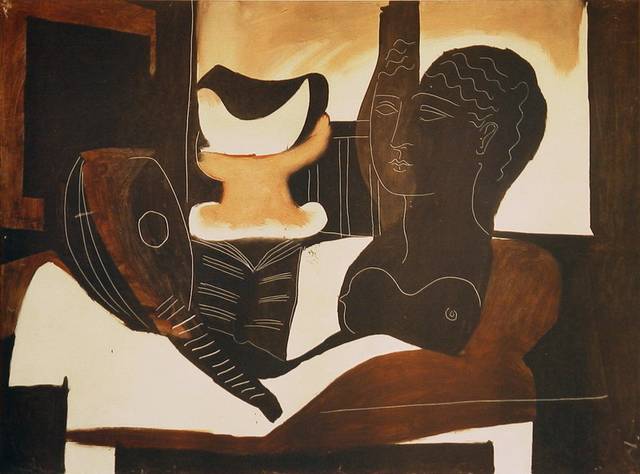
I want to click on couch, so click(x=513, y=331).